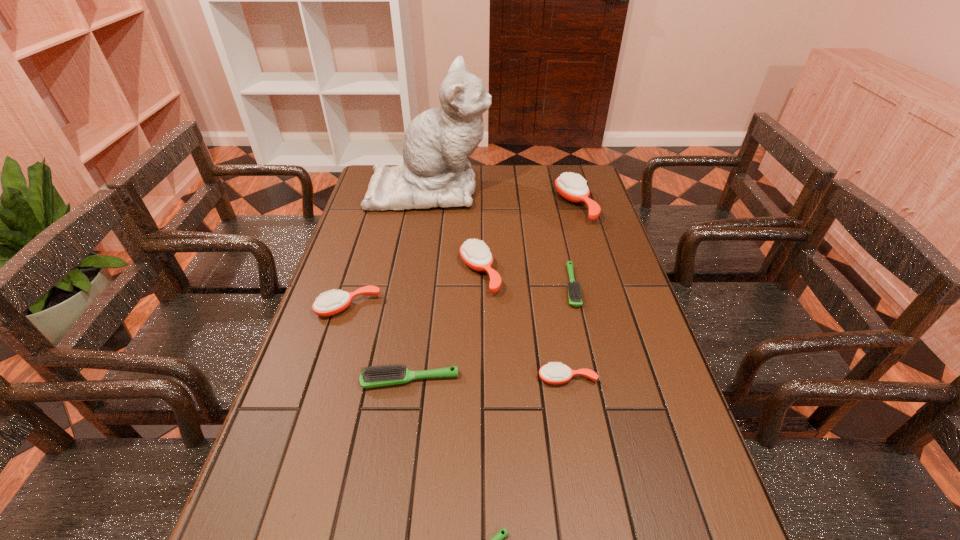
Find the location of `the third closest orange hairbrush to the rightmost orange hairbrush`. the third closest orange hairbrush to the rightmost orange hairbrush is located at coordinates (329, 304).

Locate which orange hairbrush is the third closest to the nearest orange hairbrush. Please provide its 2D coordinates. Your answer should be formatted as a tuple, i.e. [(x, y)], where the tuple contains the x and y coordinates of a point satisfying the conditions above.

[(571, 186)]

This screenshot has width=960, height=540. In order to click on the closest light hairbrush relative to the smallest orange hairbrush in this screenshot , I will do tap(383, 375).

You are a GUI agent. You are given a task and a screenshot of the screen. Output one action in this format:
    pyautogui.click(x=<x>, y=<y>)
    Task: Click on the light hairbrush identified as the closest to the smallest orange hairbrush
    The image size is (960, 540).
    Given the screenshot: What is the action you would take?
    pyautogui.click(x=383, y=375)

At what (x,y) coordinates should I click in order to perform the action: click on vacant space that satisfies the following two spatial constraints: 1. on the front-facing side of the cat; 2. on the right side of the second orange hairbrush from left to right. Please return your answer as a coordinate pair (x, y). Image resolution: width=960 pixels, height=540 pixels. Looking at the image, I should click on (416, 273).

Where is `blank area in the image that satisfies the following two spatial constraints: 1. on the front-facing side of the cat; 2. on the right side of the farthest hairbrush`? This screenshot has height=540, width=960. blank area in the image that satisfies the following two spatial constraints: 1. on the front-facing side of the cat; 2. on the right side of the farthest hairbrush is located at coordinates (426, 205).

At what (x,y) coordinates should I click in order to perform the action: click on blank area in the image that satisfies the following two spatial constraints: 1. on the front side of the sixth shortest object; 2. on the left side of the nearest orange hairbrush. Please return your answer as a coordinate pair (x, y). The height and width of the screenshot is (540, 960). Looking at the image, I should click on (480, 379).

Identify the location of free region that satisfies the following two spatial constraints: 1. on the front-facing side of the third tallest object; 2. on the left side of the tallest object. (416, 273).

You are a GUI agent. You are given a task and a screenshot of the screen. Output one action in this format:
    pyautogui.click(x=<x>, y=<y>)
    Task: Click on the vacant position in the image that satisfies the following two spatial constraints: 1. on the front-facing side of the rightmost light hairbrush; 2. on the right side of the cat
    The height and width of the screenshot is (540, 960).
    Given the screenshot: What is the action you would take?
    pyautogui.click(x=413, y=287)